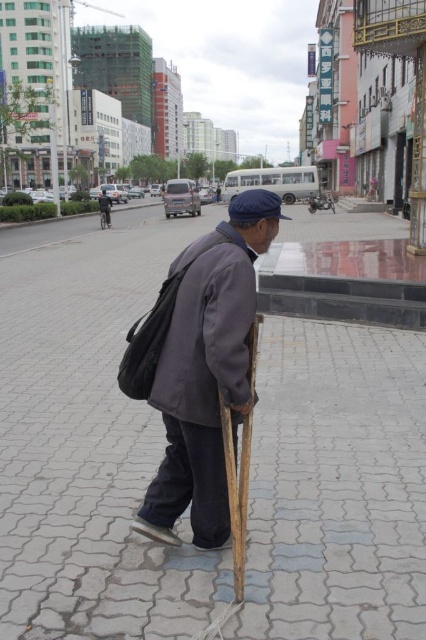
You are a delivery drone flying above an urban street scene. You need to land precisely at the point marked by the coordinates. Where should you land to reach the point labeled as point (88, 440)?

You should land on the gray cobblestone pavement at center to reach the point labeled as point (88, 440).

You are a tailor who wants to measure the distance between the two jackets to see if they can be stored together in a small closet. Can the dark gray fabric jacket at center and the dark gray woolen jacket at center fit side by side in a space that is 16 inches wide?

The distance between the dark gray fabric jacket at center and dark gray woolen jacket at center is 15.92 inches, so they can fit side by side in a 16 inch wide space since the total width required is slightly less than 16 inches.

You are a delivery person trying to place a large package on the gray cobblestone pavement at center. The package is as wide as the dark gray fabric jacket at center. Will the package fit on the pavement?

The gray cobblestone pavement at center might be wider than dark gray fabric jacket at center, so the package, which is as wide as the jacket, might fit on the pavement.